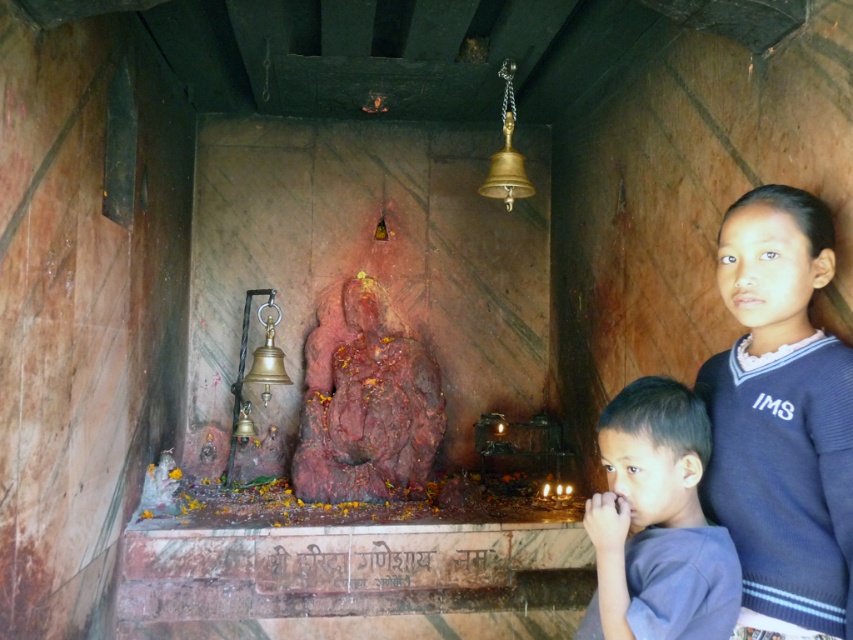
Is blue knitted sweater at right taller than gray cotton shirt at lower right?

Yes.

In the scene shown: Does blue knitted sweater at right appear over gray cotton shirt at lower right?

Yes, blue knitted sweater at right is above gray cotton shirt at lower right.

Find the location of `blue knitted sweater at right`. blue knitted sweater at right is located at coordinates (781, 419).